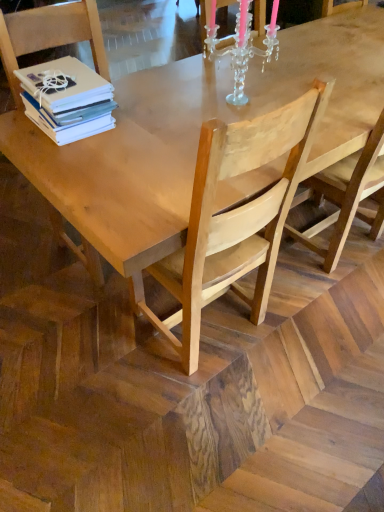
I want to click on spots to the right of white matte stack of books at upper left, so click(144, 124).